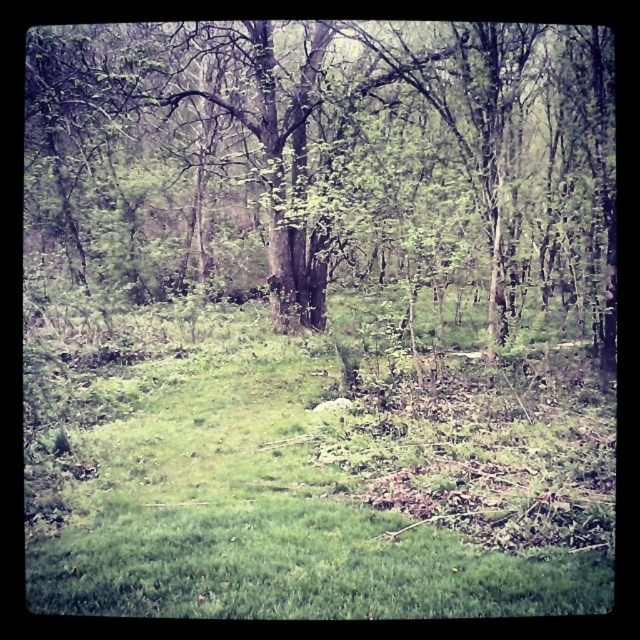
You are standing at the point with coordinates (317, 477) in the forest scene. What is the terrain like at that exact location?

The terrain at point (317, 477) is green grassy at center.

You are a hiker trying to navigate through the forest. You see the green grassy at center and the green leafy tree at center. Which one is taller?

The green leafy tree at center is taller than the green grassy at center.

You are standing in the forest and want to walk towards the green leafy tree at center. Which direction should you move relative to the green grassy at center?

Since the green grassy at center is closer to the viewer than the green leafy tree at center, you should move away from the green grassy at center to reach the green leafy tree at center.